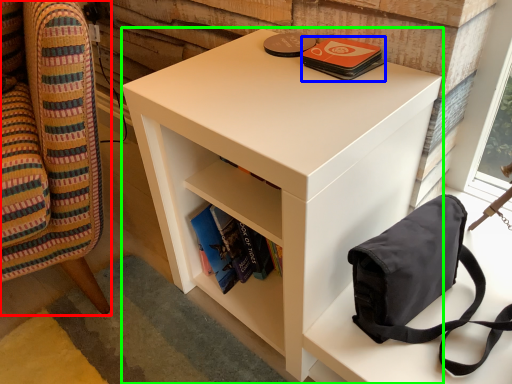
Question: Which object is the farthest from furniture (highlighted by a red box)? Choose among these: paperback book (highlighted by a blue box) or nightstand (highlighted by a green box).

Choices:
 (A) paperback book
 (B) nightstand

Answer: (A)